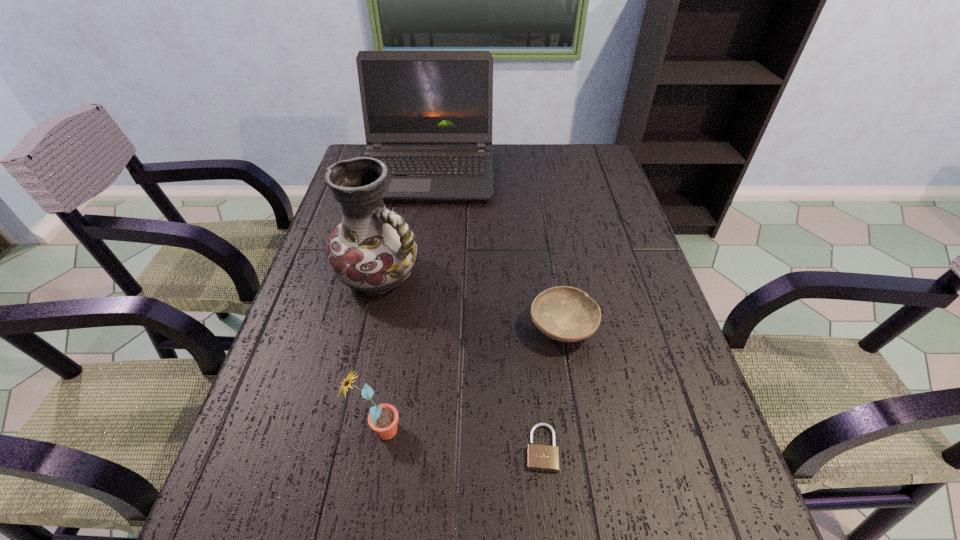
Where is `vacant point that satisfies the following two spatial constraints: 1. on the screen of the laptop_computer; 2. on the flower of the sunflower`? The width and height of the screenshot is (960, 540). vacant point that satisfies the following two spatial constraints: 1. on the screen of the laptop_computer; 2. on the flower of the sunflower is located at coordinates (387, 430).

Identify the location of free region that satisfies the following two spatial constraints: 1. on the screen of the farthest object; 2. on the right side of the shortest object. Image resolution: width=960 pixels, height=540 pixels. (384, 448).

You are a GUI agent. You are given a task and a screenshot of the screen. Output one action in this format:
    pyautogui.click(x=<x>, y=<y>)
    Task: Click on the vacant region that satisfies the following two spatial constraints: 1. on the screen of the padlock; 2. on the left side of the farthest object
    The height and width of the screenshot is (540, 960).
    Given the screenshot: What is the action you would take?
    pyautogui.click(x=384, y=448)

Where is `vacant area in the image that satisfies the following two spatial constraints: 1. on the front side of the fourth tallest object; 2. on the flower of the third shortest object`? vacant area in the image that satisfies the following two spatial constraints: 1. on the front side of the fourth tallest object; 2. on the flower of the third shortest object is located at coordinates (580, 430).

Find the location of `free space that satisfies the following two spatial constraints: 1. on the screen of the shortest object; 2. on the right side of the laptop_computer`. free space that satisfies the following two spatial constraints: 1. on the screen of the shortest object; 2. on the right side of the laptop_computer is located at coordinates (384, 448).